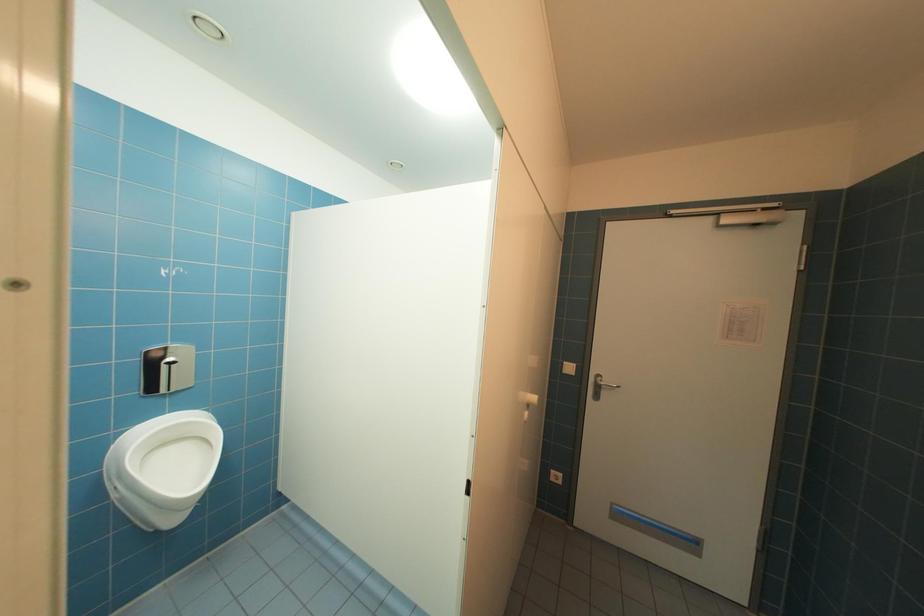
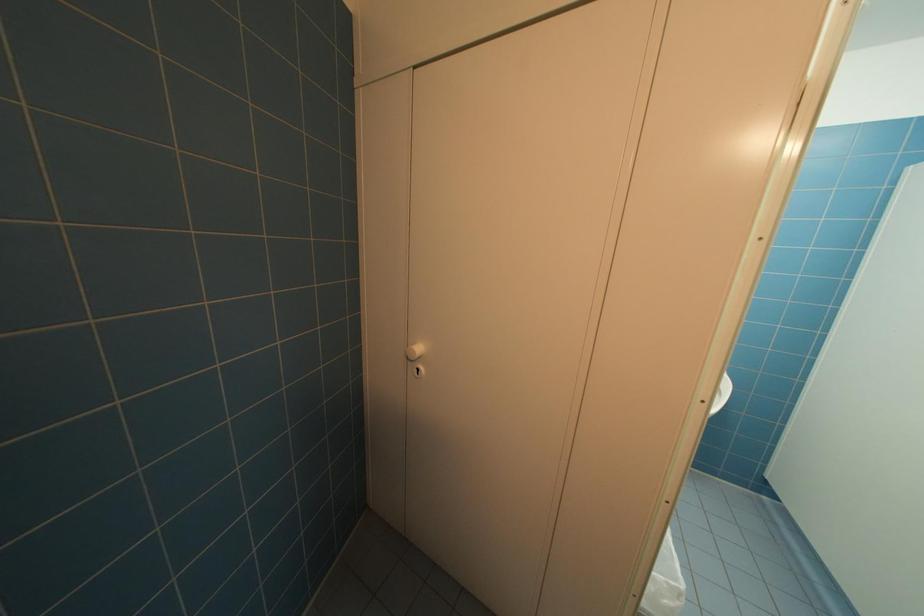
Question: The camera is either moving clockwise (left) or counter-clockwise (right) around the object. The first image is from the beginning of the video and the second image is from the end. Is the camera moving left or right when shooting the video?

Choices:
 (A) Left
 (B) Right

Answer: (B)